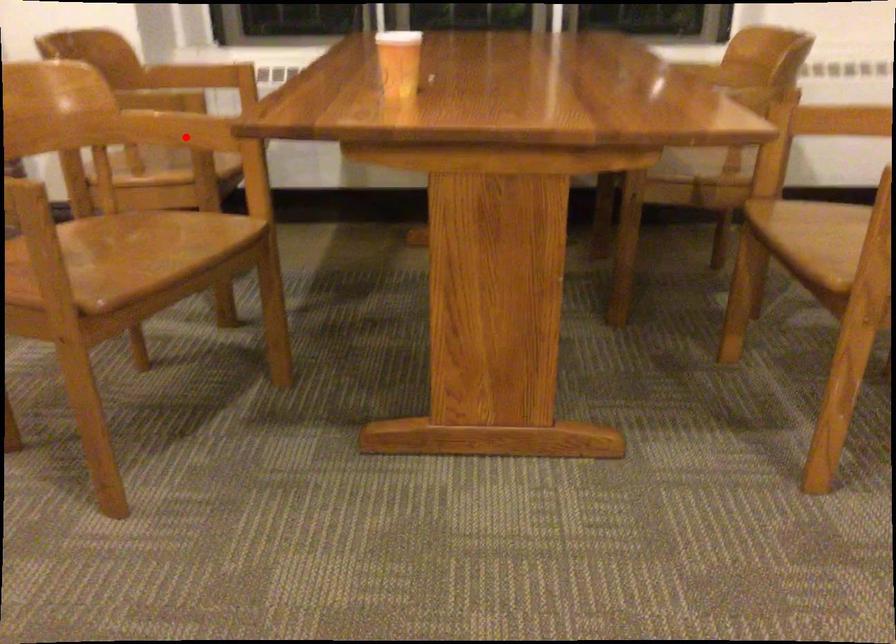
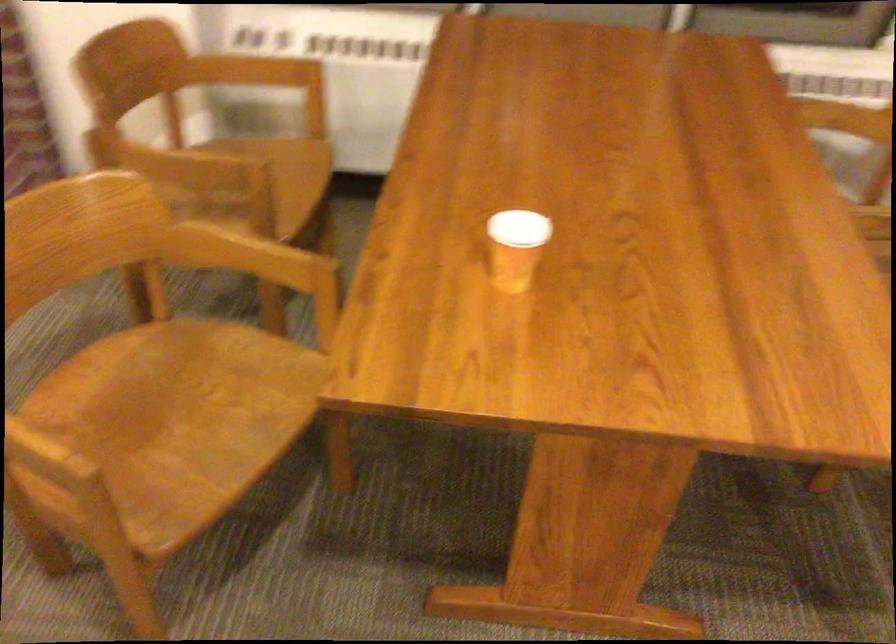
Where in the second image is the point corresponding to the highlighted location from the first image?

(248, 257)